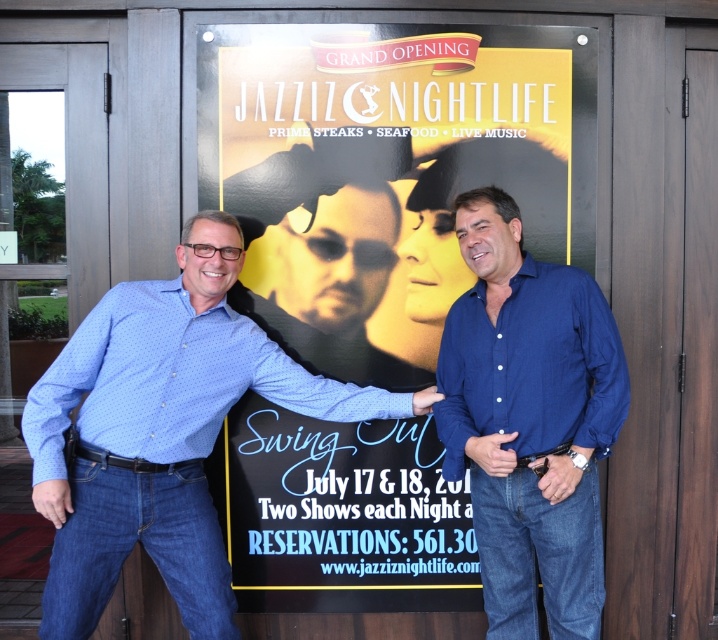
Question: Which point is closer to the camera?

Choices:
 (A) yellow paper poster at center
 (B) blue cotton shirt at right

Answer: (B)

Question: Does yellow paper poster at center appear on the right side of blue cotton shirt at right?

Choices:
 (A) yes
 (B) no

Answer: (B)

Question: Estimate the real-world distances between objects in this image. Which object is closer to the blue dotted shirt at left?

Choices:
 (A) blue cotton shirt at right
 (B) yellow paper poster at center

Answer: (B)

Question: Does yellow paper poster at center have a greater width compared to blue dotted shirt at left?

Choices:
 (A) no
 (B) yes

Answer: (B)

Question: Which object appears farthest from the camera in this image?

Choices:
 (A) blue dotted shirt at left
 (B) blue cotton shirt at right

Answer: (A)

Question: Can you confirm if blue dotted shirt at left is positioned to the right of blue cotton shirt at right?

Choices:
 (A) yes
 (B) no

Answer: (B)